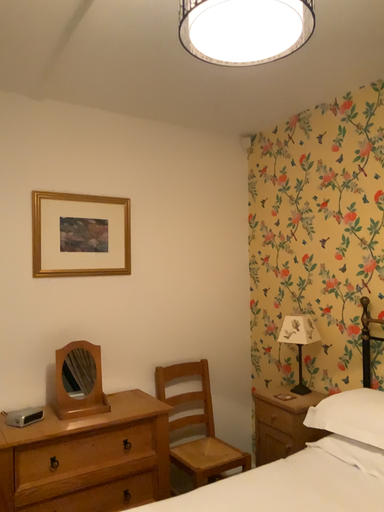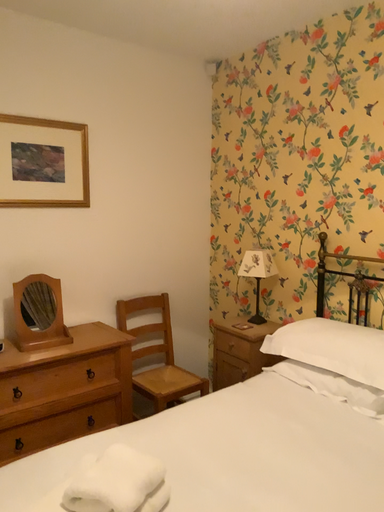
Question: How did the camera likely rotate when shooting the video?

Choices:
 (A) rotated upward
 (B) rotated downward

Answer: (B)